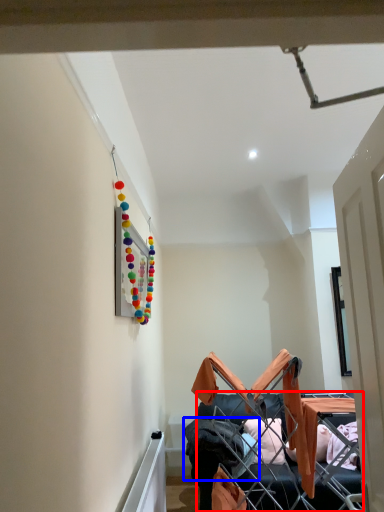
Question: Which object appears farthest to the camera in this image, furniture (highlighted by a red box) or clothing (highlighted by a blue box)?

Choices:
 (A) furniture
 (B) clothing

Answer: (B)